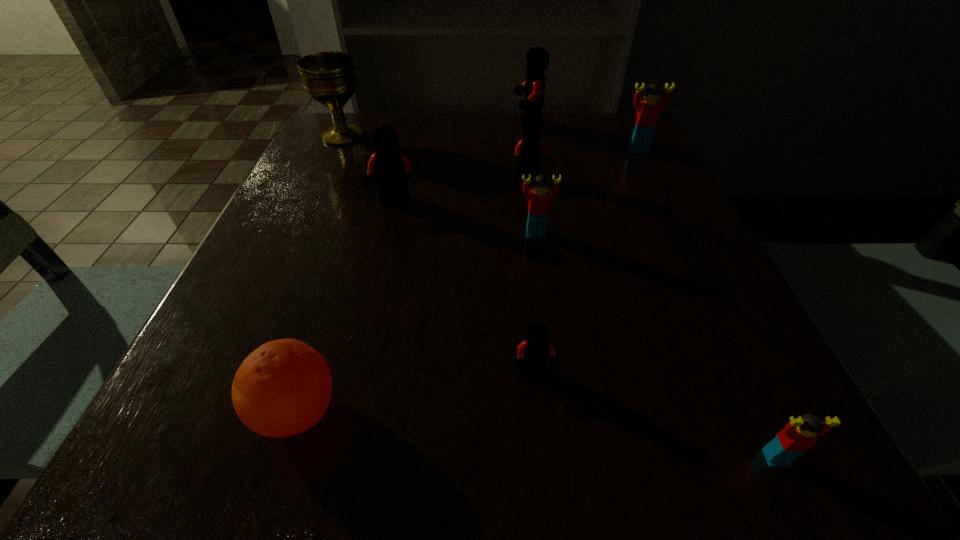
This screenshot has height=540, width=960. In order to click on vacant space located 0.370m on the face of the second farthest Lego in this screenshot , I will do `click(697, 268)`.

The height and width of the screenshot is (540, 960). Identify the location of blank space located on the front-facing side of the leftmost black Lego. (365, 336).

Locate an element on the screen. The width and height of the screenshot is (960, 540). free space located 0.270m on the face of the leftmost red Lego is located at coordinates (555, 369).

The height and width of the screenshot is (540, 960). What are the coordinates of `vacant space located on the front-facing side of the second smallest black Lego` in the screenshot? It's located at (552, 328).

The image size is (960, 540). I want to click on free space located 0.050m on the right of the orange, so click(x=379, y=413).

Find the location of `chalice at the far edge`. chalice at the far edge is located at coordinates coord(329,78).

The height and width of the screenshot is (540, 960). What are the coordinates of `orange that is at the near edge` in the screenshot? It's located at [283, 388].

The width and height of the screenshot is (960, 540). I want to click on Lego at the near edge, so click(798, 436).

Where is `chalice situated at the left edge`? The height and width of the screenshot is (540, 960). chalice situated at the left edge is located at coordinates (329, 78).

This screenshot has width=960, height=540. I want to click on orange positioned at the left edge, so click(x=283, y=388).